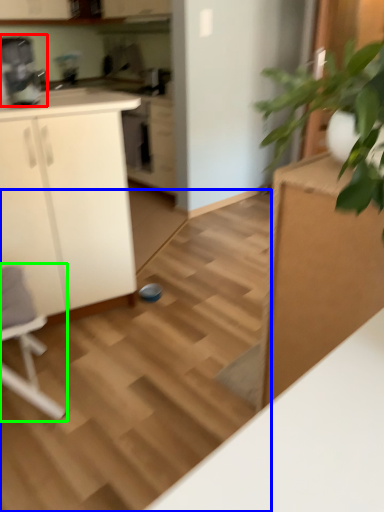
Question: Which object is positioned farthest from coffee machine (highlighted by a red box)? Select from stair (highlighted by a blue box) and rocking chair (highlighted by a green box).

Choices:
 (A) stair
 (B) rocking chair

Answer: (B)